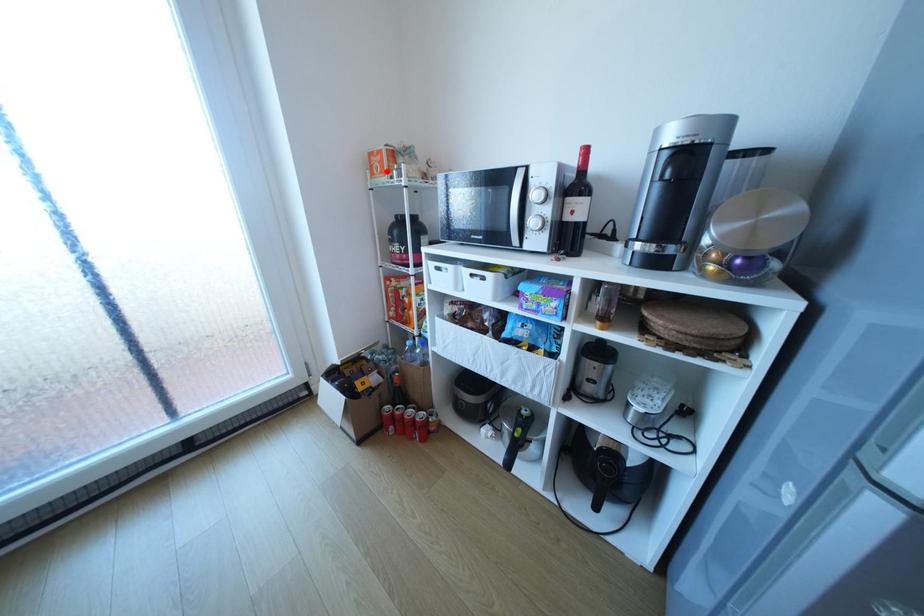
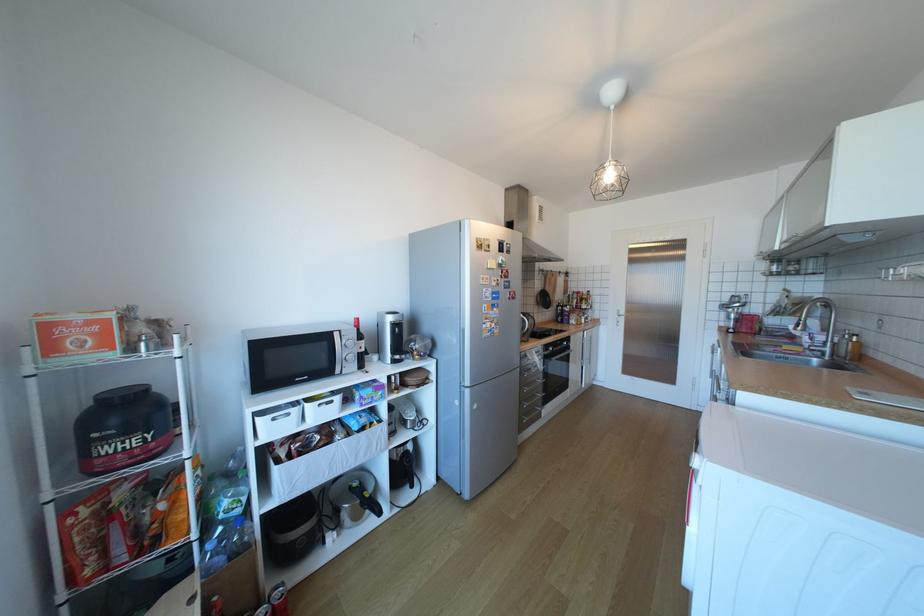
Question: I am providing you with two images of the same scene from different viewpoints. A red point is shown in image1. For the corresponding object point in image2, is it positioned nearer or farther from the camera?

Choices:
 (A) Nearer
 (B) Farther

Answer: (B)